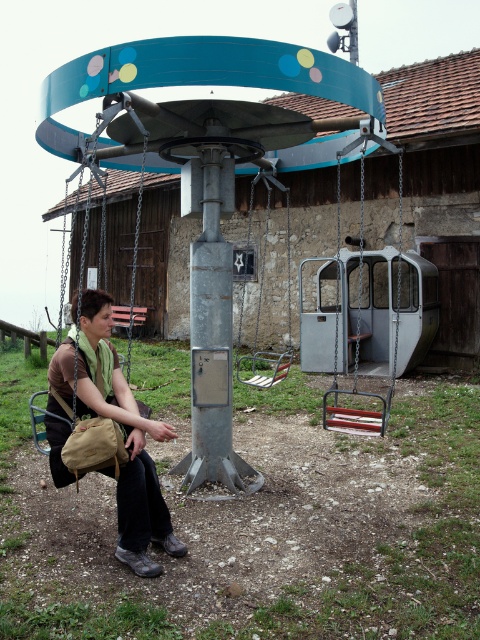
You are standing in front of the playground and want to sit on the metallic swing at center. However, there is another metallic silver swing at center. Which one is closer to you?

The metallic swing at center is closer to the viewer than the metallic silver swing at center, so you should choose the metallic swing at center.

You are a photographer trying to capture a photo of the metallic silver swing at center and the khaki canvas bag at lower left. Since you want both objects to be clearly visible in your shot, which object should you focus on first to ensure proper depth of field?

The khaki canvas bag at lower left has a lesser height compared to the metallic silver swing at center, so you should focus on the metallic silver swing at center first to ensure both are in focus.